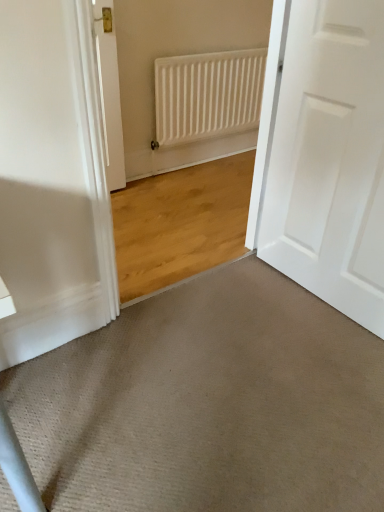
Question: Could you tell me if white matte radiator at upper center is turned towards beige carpet at lower center?

Choices:
 (A) yes
 (B) no

Answer: (A)

Question: Considering the relative sizes of white matte radiator at upper center and beige carpet at lower center in the image provided, is white matte radiator at upper center shorter than beige carpet at lower center?

Choices:
 (A) yes
 (B) no

Answer: (B)

Question: Is white matte radiator at upper center completely or partially outside of beige carpet at lower center?

Choices:
 (A) no
 (B) yes

Answer: (B)

Question: Is white matte radiator at upper center facing away from beige carpet at lower center?

Choices:
 (A) yes
 (B) no

Answer: (B)

Question: Considering the relative sizes of white matte radiator at upper center and beige carpet at lower center in the image provided, is white matte radiator at upper center wider than beige carpet at lower center?

Choices:
 (A) no
 (B) yes

Answer: (A)

Question: From the image's perspective, would you say white matte radiator at upper center is positioned over beige carpet at lower center?

Choices:
 (A) yes
 (B) no

Answer: (A)

Question: Would you consider white matte radiator at upper center to be distant from white matte door at right?

Choices:
 (A) yes
 (B) no

Answer: (A)

Question: Is white matte radiator at upper center smaller than white matte door at right?

Choices:
 (A) yes
 (B) no

Answer: (A)

Question: Can white matte door at right be found inside white matte radiator at upper center?

Choices:
 (A) yes
 (B) no

Answer: (B)

Question: Is white matte radiator at upper center thinner than white matte door at right?

Choices:
 (A) no
 (B) yes

Answer: (B)

Question: Is white matte radiator at upper center next to white matte door at right and touching it?

Choices:
 (A) no
 (B) yes

Answer: (A)

Question: Is white matte radiator at upper center positioned with its back to white matte door at right?

Choices:
 (A) no
 (B) yes

Answer: (A)

Question: Does beige carpet at lower center have a lesser width compared to white matte door at right?

Choices:
 (A) yes
 (B) no

Answer: (B)